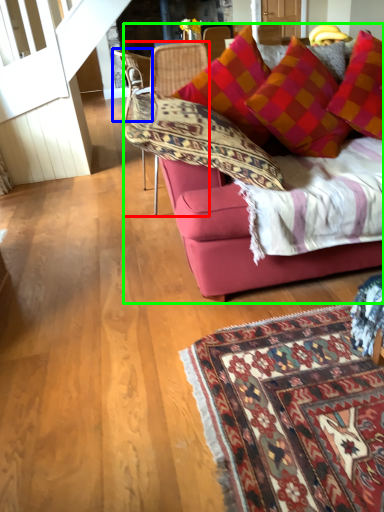
Question: Which object is the closest to the chair (highlighted by a red box)? Choose among these: chair (highlighted by a blue box) or studio couch (highlighted by a green box).

Choices:
 (A) chair
 (B) studio couch

Answer: (B)